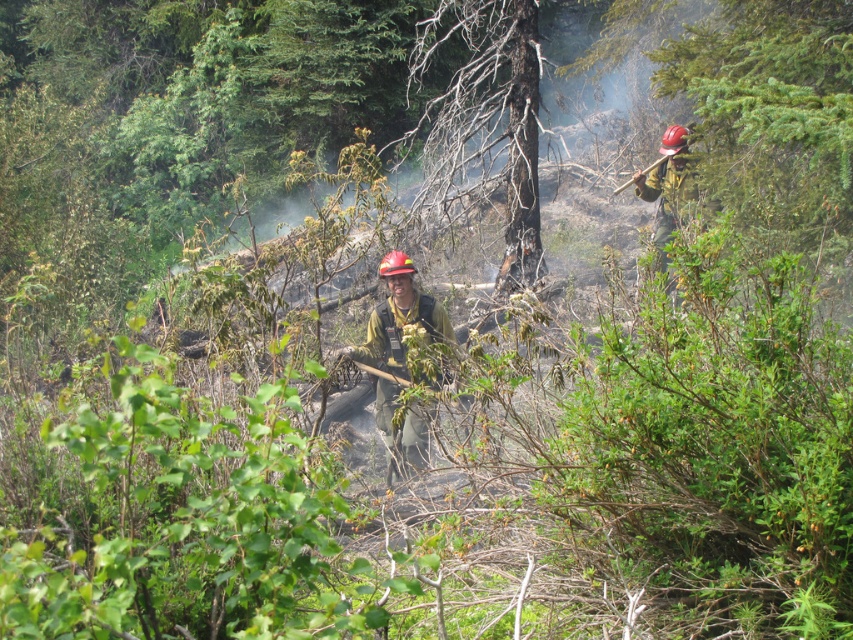
You are a firefighter assessing the scene. You need to determine if the matte green uniform at center can fully cover the hardened plastic helmet at upper right when folded. Based on their sizes, what would you conclude?

The matte green uniform at center is larger than the hardened plastic helmet at upper right, so it can fully cover the hardened plastic helmet at upper right when folded.

You are a firefighter navigating through a smoky forest. You need to reach a critical point in the forest. There are two points marked in the image. Which point is closer to you, point (424, 312) or point (689, 180)?

Point (424, 312) is closer to the viewer than point (689, 180), so you should head towards point (424, 312) first.